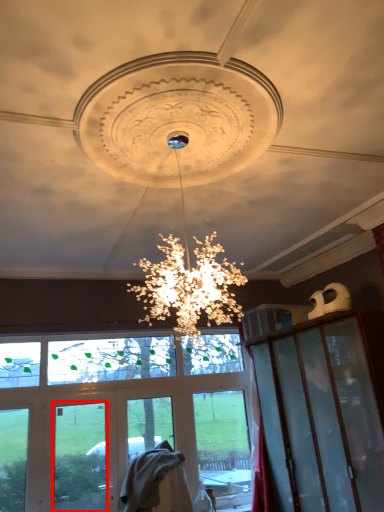
Question: From the image's perspective, what is the correct spatial positioning of glass window (annotated by the red box) in reference to window screen?

Choices:
 (A) below
 (B) above

Answer: (A)